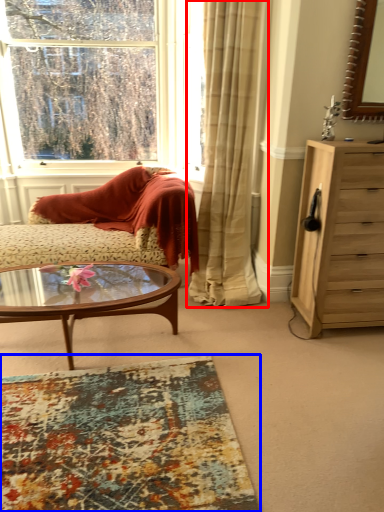
Question: Which object is closer to the camera taking this photo, curtain (highlighted by a red box) or plain (highlighted by a blue box)?

Choices:
 (A) curtain
 (B) plain

Answer: (B)